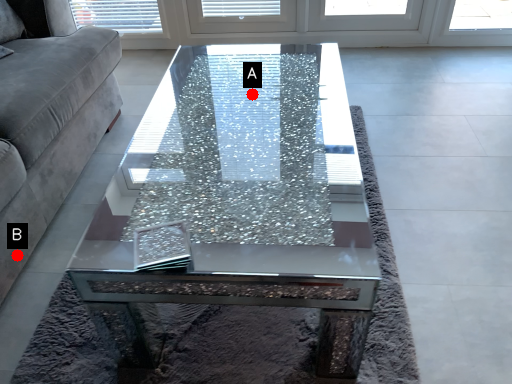
Question: Two points are circled on the image, labeled by A and B beside each circle. Which point is farther to the camera?

Choices:
 (A) A is further
 (B) B is further

Answer: (A)